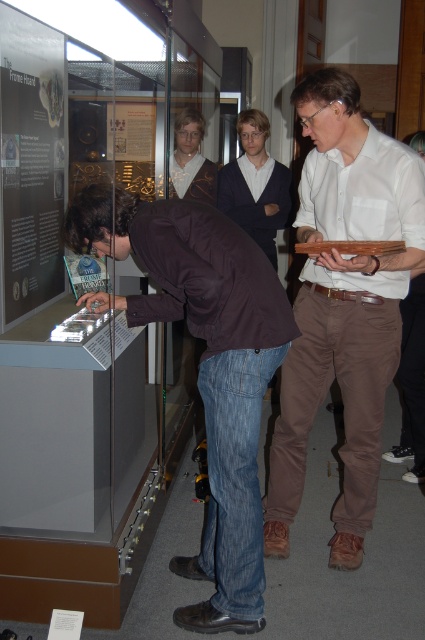
Is brown leather jacket at lower left smaller than dark blue sweater at center?

Incorrect, brown leather jacket at lower left is not smaller in size than dark blue sweater at center.

Does brown leather jacket at lower left appear over dark blue sweater at center?

No.

Between point (99, 204) and point (226, 204), which one is positioned behind?

The point (226, 204) is behind.

You are a GUI agent. You are given a task and a screenshot of the screen. Output one action in this format:
    pyautogui.click(x=<x>, y=<y>)
    Task: Click on the brown leather jacket at lower left
    
    Given the screenshot: What is the action you would take?
    pyautogui.click(x=206, y=368)

Who is lower down, matte white shirt at center or matte brown vest at center?

matte white shirt at center

The image size is (425, 640). Identify the location of matte white shirt at center. (343, 305).

Where is `matte white shirt at center`? Image resolution: width=425 pixels, height=640 pixels. matte white shirt at center is located at coordinates (343, 305).

Identify the location of matte white shirt at center. Image resolution: width=425 pixels, height=640 pixels. (343, 305).

How distant is matte white shirt at center from brown leather jacket at lower left?

matte white shirt at center and brown leather jacket at lower left are 20.25 inches apart.

Does point (365, 492) come farther from viewer compared to point (252, 548)?

Yes, point (365, 492) is farther from viewer.

Where is `matte white shirt at center`? The width and height of the screenshot is (425, 640). matte white shirt at center is located at coordinates (343, 305).